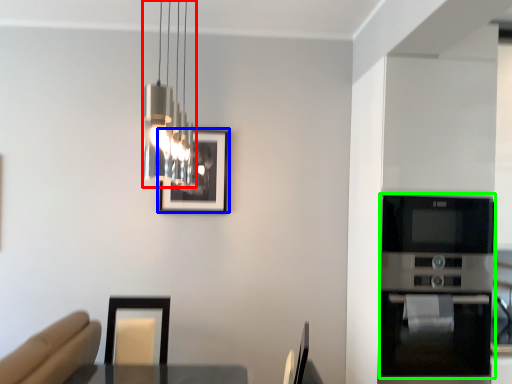
Question: Which object is the farthest from lamp (highlighted by a red box)? Choose among these: picture frame (highlighted by a blue box) or appliance (highlighted by a green box).

Choices:
 (A) picture frame
 (B) appliance

Answer: (B)